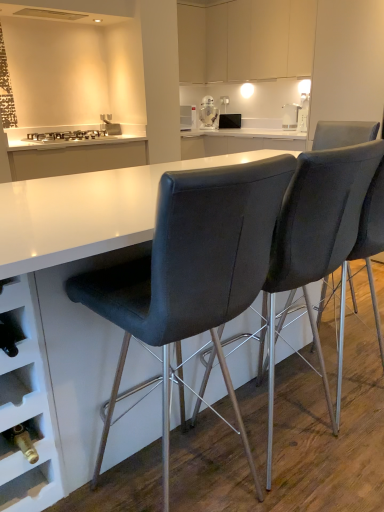
Question: Is matte black microwave at center, the first appliance when ordered from right to left, in front of or behind white glossy r2-d2 droid at upper center, which ranks as the 1th appliance in left-to-right order, in the image?

Choices:
 (A) behind
 (B) front

Answer: (B)

Question: From a real-world perspective, is matte black microwave at center, the 2th appliance from the left, physically located above or below white glossy r2-d2 droid at upper center, which is the second appliance from right to left?

Choices:
 (A) below
 (B) above

Answer: (A)

Question: Which object is positioned farthest from the matte white cabinets at upper center?

Choices:
 (A) matte black microwave at center, the 2th appliance from the left
 (B) white glossy toaster at upper right
 (C) matte black chair at center, arranged as the 2th chair when viewed from the left
 (D) white glossy stove at upper left
 (E) white glossy r2-d2 droid at upper center, which ranks as the 1th appliance in left-to-right order

Answer: (C)

Question: Based on their relative distances, which object is farther from the white glossy stove at upper left?

Choices:
 (A) matte white cabinets at upper center
 (B) matte black chair at center, arranged as the 2th chair when viewed from the left
 (C) white glossy toaster at upper right
 (D) white glossy r2-d2 droid at upper center, which is the second appliance from right to left
 (E) matte black microwave at center, the first appliance when ordered from right to left

Answer: (B)